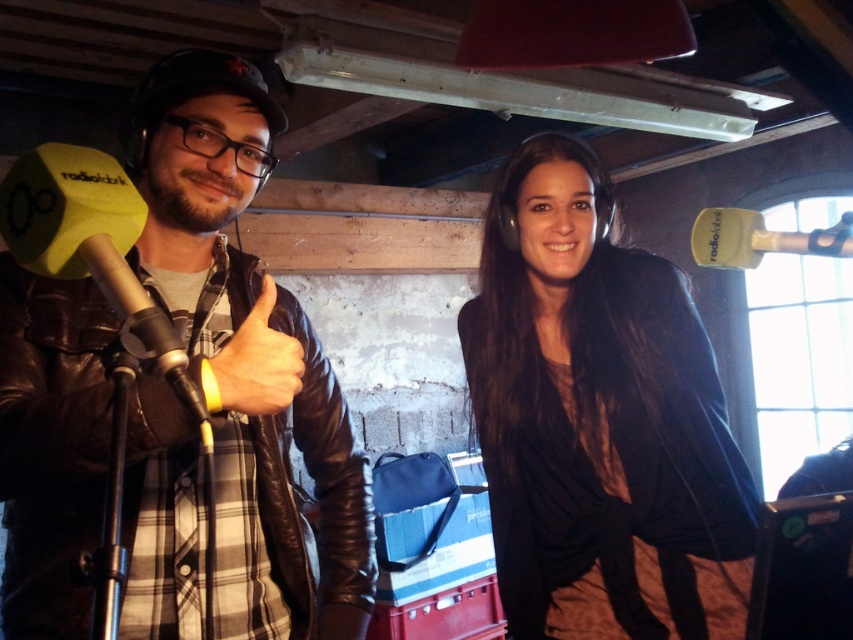
Is leather jacket at left positioned in front of matte black jacket at center?

Yes, it is in front of matte black jacket at center.

Does leather jacket at left appear on the left side of matte black jacket at center?

Correct, you'll find leather jacket at left to the left of matte black jacket at center.

Which is behind, point (250, 131) or point (498, 531)?

Positioned behind is point (498, 531).

Where is `leather jacket at left`? leather jacket at left is located at coordinates (248, 355).

Can you confirm if leather jacket at left is smaller than leather at left?

Actually, leather jacket at left might be larger than leather at left.

Who is more distant from viewer, (229, 400) or (265, 380)?

The point (265, 380) is behind.

Is point (102, 499) farther from viewer compared to point (225, 356)?

Yes, point (102, 499) is farther from viewer.

At what (x,y) coordinates should I click in order to perform the action: click on leather jacket at left. Please return your answer as a coordinate pair (x, y). This screenshot has width=853, height=640. Looking at the image, I should click on (248, 355).

Can you confirm if leather at left is positioned to the left of matte black microphone at left?

In fact, leather at left is to the right of matte black microphone at left.

Which is behind, point (259, 385) or point (173, 374)?

The point (259, 385) is behind.

Is point (283, 374) more distant than point (141, 330)?

Yes, point (283, 374) is farther from viewer.

The image size is (853, 640). In order to click on leather at left in this screenshot , I will do `click(254, 364)`.